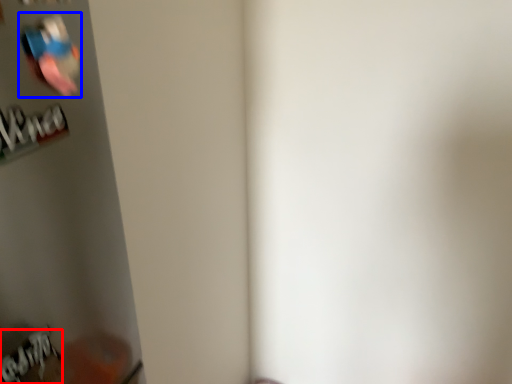
Question: Which object is closer to the camera taking this photo, writing (highlighted by a red box) or Wii controller (highlighted by a blue box)?

Choices:
 (A) writing
 (B) Wii controller

Answer: (B)